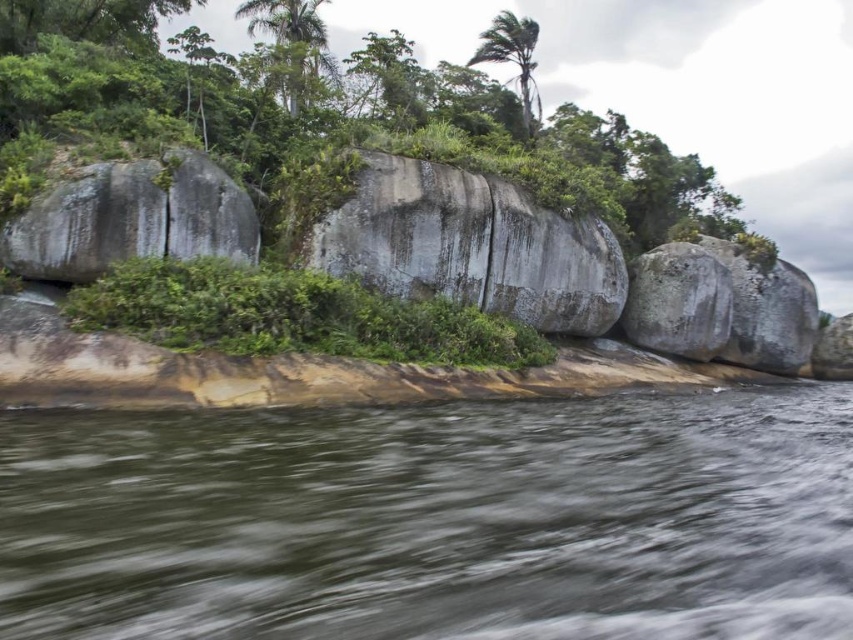
You are standing on the riverbank and see the brown water at lower center and the gray rough boulder at left. Which object takes up more space in the image?

The brown water at lower center takes up more space in the image because it is bigger than the gray rough boulder at left.

You are standing at the riverbank and want to reach the point marked as point (x=51, y=195). Which direction should you move from point (x=361, y=563) to get there?

You should move towards the lower left direction from point (x=361, y=563) to reach point (x=51, y=195).

You are standing at the riverbank and see the point marked as point (434, 520). Is this point located in the water or on the riverbank?

The point (434, 520) is in the water because the brown water at lower center is represented by point (434, 520).